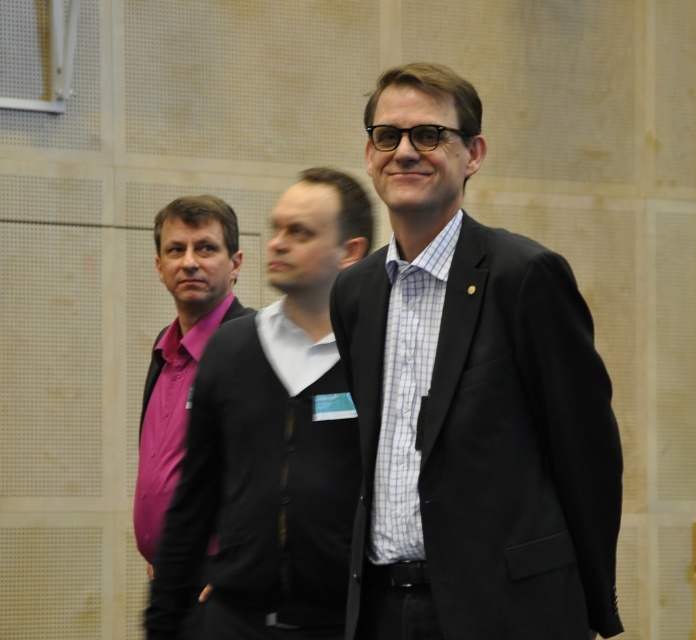
From the picture: You are standing in the room and see two points marked on the wall. The first point is at coordinates point (459, 161) and the second is at point (294, 481). Which point is nearer to you?

Point (459, 161) is closer to the viewer than point (294, 481).

You are a photographer setting up a photo shoot with two subjects wearing the matte black suit at center and the pink fabric shirt at left. You want to ensure that the taller subject is positioned in the center of the frame. Based on their heights, which subject should be placed in the center?

The matte black suit at center has a greater height compared to the pink fabric shirt at left, so the subject wearing the matte black suit at center should be placed in the center to emphasize their height advantage.